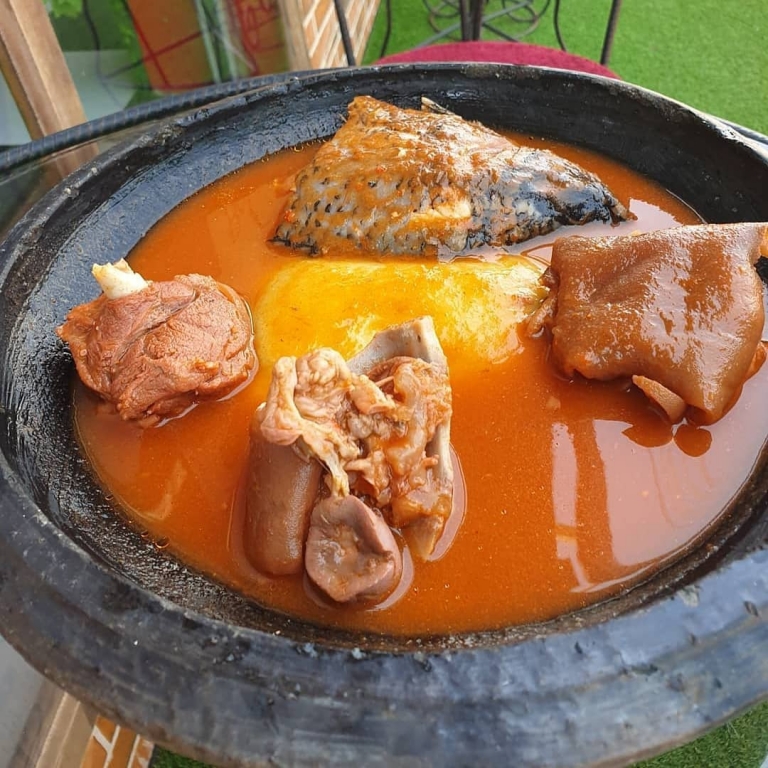
At what (x,y) coordinates should I click in order to perform the action: click on chair. Please return your answer as a coordinate pair (x, y). Looking at the image, I should click on (478, 25).